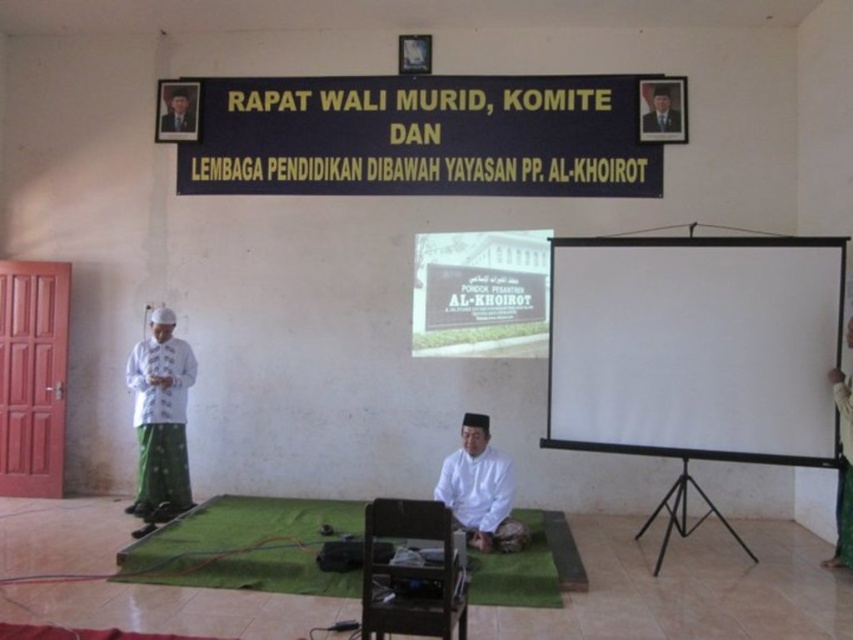
Question: Which of the following is the closest to the observer?

Choices:
 (A) pyautogui.click(x=161, y=307)
 (B) pyautogui.click(x=662, y=244)

Answer: (B)

Question: Which object appears closest to the camera in this image?

Choices:
 (A) black plastic signboard at upper center
 (B) white matte shirt at center
 (C) green carpet at center

Answer: (C)

Question: Does green fabric at right have a greater width compared to formal suit at upper right?

Choices:
 (A) no
 (B) yes

Answer: (A)

Question: Which object appears farthest from the camera in this image?

Choices:
 (A) green carpet at center
 (B) wooden chair at center
 (C) matte black photo frame at upper left
 (D) formal suit at upper right

Answer: (C)

Question: Is white matte projection screen at right below green fabric at right?

Choices:
 (A) no
 (B) yes

Answer: (A)

Question: Does black plastic signboard at upper center appear on the right side of white matte shirt at center?

Choices:
 (A) yes
 (B) no

Answer: (B)